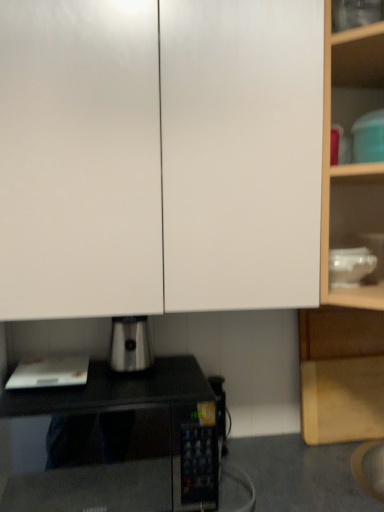
Question: Choose the correct answer: Is satin silver coffee maker at lower center inside teal plastic container at upper right, the third appliance when ordered from left to right, or outside it?

Choices:
 (A) inside
 (B) outside

Answer: (B)

Question: Is satin silver coffee maker at lower center taller or shorter than teal plastic container at upper right, the third appliance when ordered from left to right?

Choices:
 (A) tall
 (B) short

Answer: (B)

Question: Estimate the real-world distances between objects in this image. Which object is closer to the teal plastic container at upper right, the third appliance when ordered from left to right?

Choices:
 (A) satin silver coffee maker at lower center
 (B) black matte microwave oven at center
 (C) white matte paper at lower left, which is the 3th appliance in right-to-left order
 (D) transparent glass bowl at upper right, arranged as the 2th appliance when viewed from the top
 (E) wooden cabinet at right, which appears as the first cabinetry when viewed from the back

Answer: (D)

Question: Which is farther from the white glossy cabinet doors at upper center, which is counted as the second cabinetry, starting from the bottom?

Choices:
 (A) white matte paper at lower left, which is the 3th appliance in right-to-left order
 (B) transparent glass bowl at upper right, placed as the 2th appliance when sorted from bottom to top
 (C) wooden cabinet at right, acting as the 1th cabinetry starting from the bottom
 (D) teal plastic container at upper right, positioned as the first appliance in right-to-left order
 (E) black matte microwave oven at center

Answer: (C)